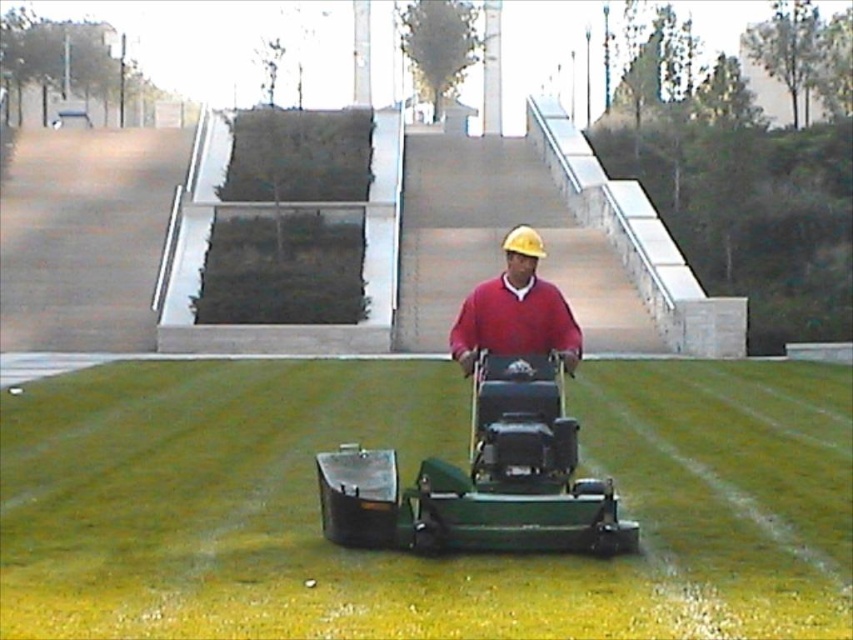
You are a landscape worker standing on the grassy area. You need to place a new potted plant exactly where the matte red sweater at center is currently located. However, the potted plant must be placed on the green grass at center. Is this possible?

The green grass at center is located below matte red sweater at center, so yes, the potted plant can be placed on the green grass at center where the matte red sweater is positioned.

You are a landscape designer assessing the lawn area. You notice the green grass at center and the matte red sweater at center. Which object occupies more horizontal space in the image?

The green grass at center has a greater width than the matte red sweater at center, so it occupies more horizontal space.

You are a gardener who needs to place a new decorative rock in the scene. The rock is the same size as the green grass at center. Will the rock fit in the space where the matte red sweater at center is currently located?

The green grass at center has a smaller size compared to matte red sweater at center. Since the rock is the same size as the green grass at center, it will not fit in the space where the matte red sweater at center is located because the sweater is larger.